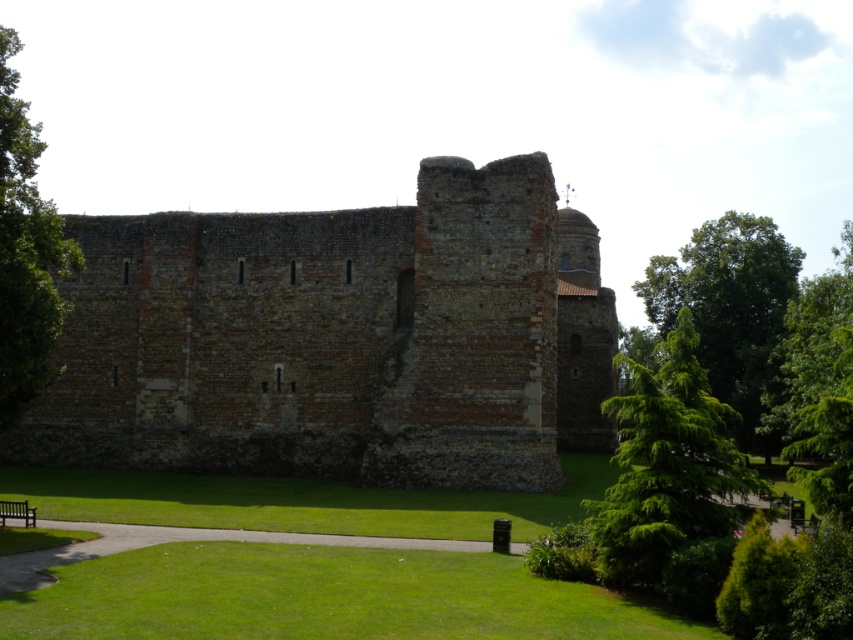
Consider the image. You are a painter planning to sketch the historic stone structure. You notice the brown stone wall at center and the green leafy tree at right in your viewfinder. Which object takes up more space in the scene?

The green leafy tree at right occupies more space than the brown stone wall at center according to the description.

You are a gardener planning to trim the branches of both the green leafy tree at left and the green leafy tree at right. Based on their sizes, which tree will require more time and effort to trim?

The green leafy tree at right requires more time and effort to trim because it is larger than the green leafy tree at left.

You are standing at the entrance of the historic stone structure and want to find the green leafy tree at left. Which direction should you face to see it?

The green leafy tree at left is located at the coordinates (25, 253), which places it to the left side of the scene. Therefore, you should face towards the left direction to see the green leafy tree at left.